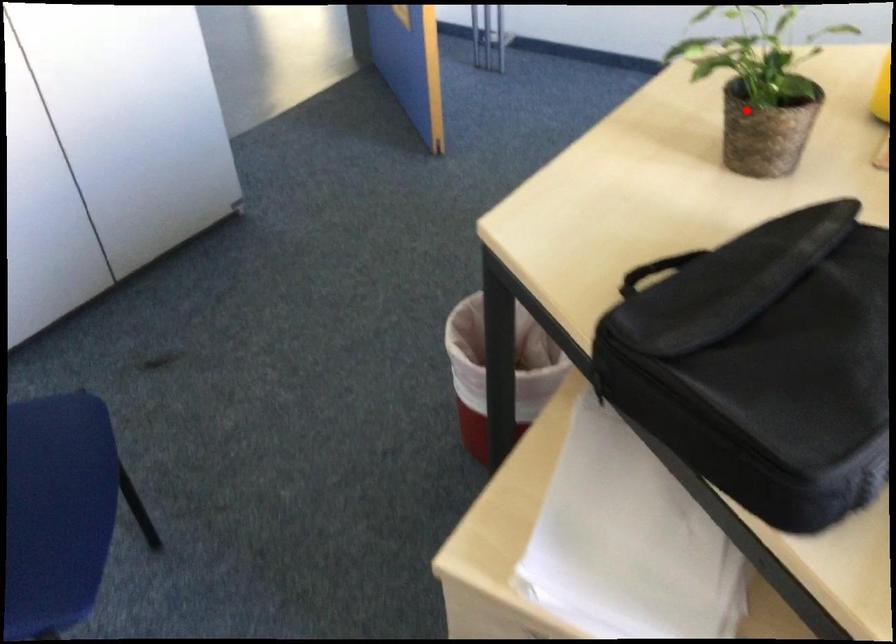
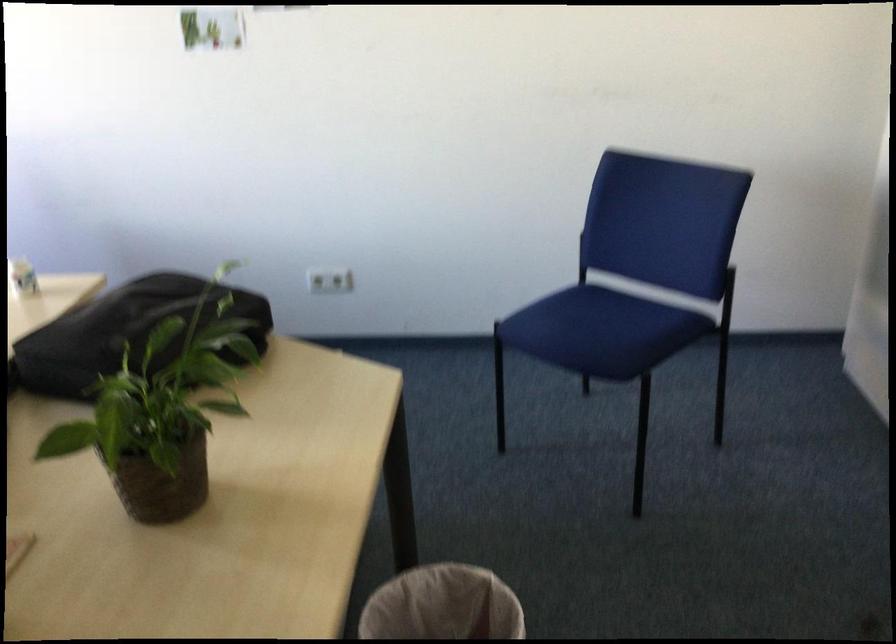
Find the pixel in the second image that matches the highlighted location in the first image.

(162, 413)